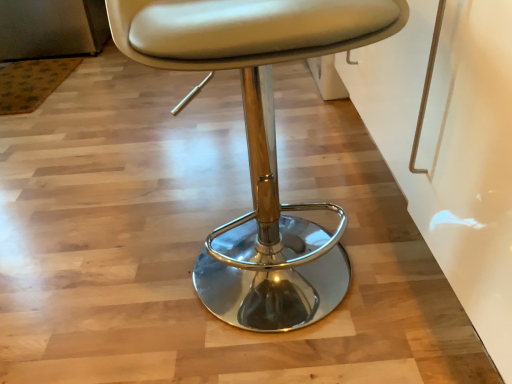
Where is `vacant area to the left of beige leather stool at center`? vacant area to the left of beige leather stool at center is located at coordinates (106, 279).